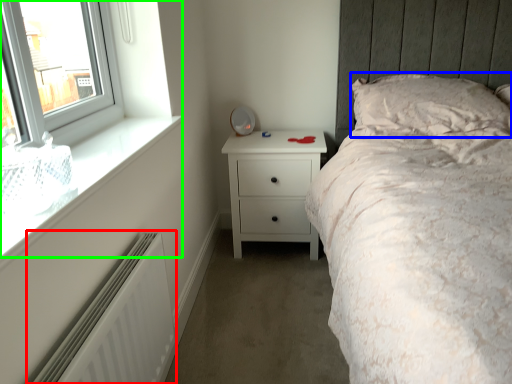
Question: Which is farther away from radiator (highlighted by a red box)? pillow (highlighted by a blue box) or window (highlighted by a green box)?

Choices:
 (A) pillow
 (B) window

Answer: (A)